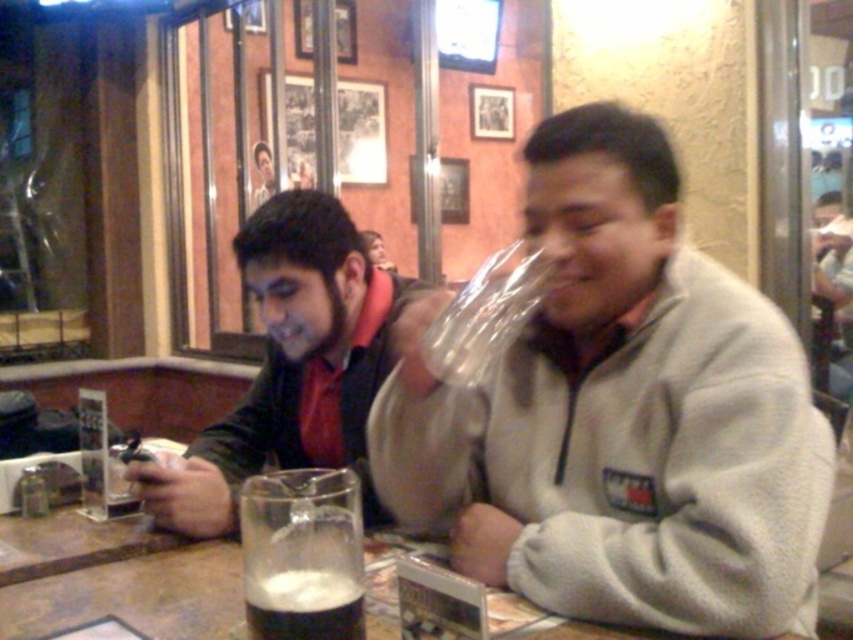
You are a photographer standing at a certain distance from the gray fleece jacket at center. You want to take a closeup photo of it without moving the jacket. Is the current distance sufficient for a clear closeup shot?

The gray fleece jacket at center is 32.21 inches away from camera. A typical camera requires a minimum distance of about 12 inches for a clear closeup. Since 32.21 inches is greater than 12 inches, the current distance is sufficient for a clear closeup shot.